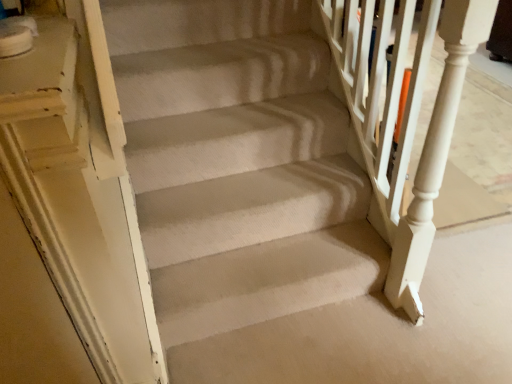
Question: Is beige carpeted stairs at center shorter than white textured rail at upper right?

Choices:
 (A) yes
 (B) no

Answer: (A)

Question: Is beige carpeted stairs at center at the left side of white textured rail at upper right?

Choices:
 (A) yes
 (B) no

Answer: (A)

Question: Can you confirm if beige carpeted stairs at center is thinner than white textured rail at upper right?

Choices:
 (A) no
 (B) yes

Answer: (A)

Question: Can you confirm if beige carpeted stairs at center is positioned to the right of white textured rail at upper right?

Choices:
 (A) no
 (B) yes

Answer: (A)

Question: Would you say beige carpeted stairs at center is a long distance from white textured rail at upper right?

Choices:
 (A) no
 (B) yes

Answer: (A)

Question: Could you tell me if beige carpeted stairs at center is turned towards white textured rail at upper right?

Choices:
 (A) no
 (B) yes

Answer: (A)

Question: Is white textured rail at upper right wider than beige carpeted stairs at center?

Choices:
 (A) yes
 (B) no

Answer: (B)

Question: Is white textured rail at upper right looking in the opposite direction of beige carpeted stairs at center?

Choices:
 (A) yes
 (B) no

Answer: (B)

Question: From a real-world perspective, is white textured rail at upper right on top of beige carpeted stairs at center?

Choices:
 (A) yes
 (B) no

Answer: (A)

Question: Is white textured rail at upper right placed right next to beige carpeted stairs at center?

Choices:
 (A) no
 (B) yes

Answer: (A)

Question: Can you confirm if white textured rail at upper right is thinner than beige carpeted stairs at center?

Choices:
 (A) yes
 (B) no

Answer: (A)

Question: Is white textured rail at upper right at the right side of beige carpeted stairs at center?

Choices:
 (A) no
 (B) yes

Answer: (B)

Question: From the image's perspective, is beige carpeted stairs at center located above or below white textured rail at upper right?

Choices:
 (A) below
 (B) above

Answer: (A)